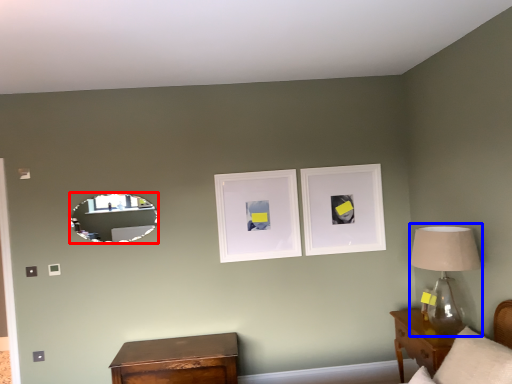
Question: Which object is closer to the camera taking this photo, mirror (highlighted by a red box) or table lamp (highlighted by a blue box)?

Choices:
 (A) mirror
 (B) table lamp

Answer: (B)